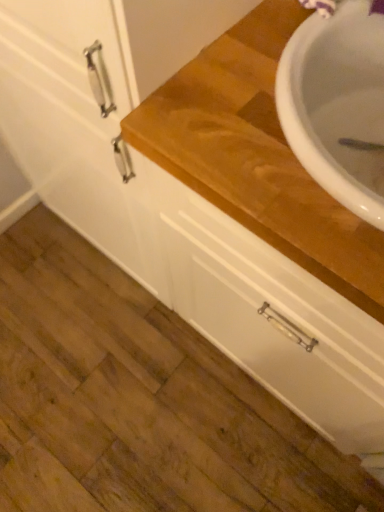
This screenshot has height=512, width=384. Describe the element at coordinates (273, 315) in the screenshot. I see `white matte drawer at center` at that location.

Locate an element on the screen. Image resolution: width=384 pixels, height=512 pixels. white matte drawer at center is located at coordinates (273, 315).

Find the location of a particular element. The height and width of the screenshot is (512, 384). wooden at upper right is located at coordinates (256, 155).

What do you see at coordinates (256, 155) in the screenshot? The image size is (384, 512). I see `wooden at upper right` at bounding box center [256, 155].

What is the approximate height of wooden at upper right?

wooden at upper right is 35.99 inches in height.

I want to click on white matte drawer at center, so point(273,315).

Consider the image. Is white matte drawer at center at the right side of wooden at upper right?

In fact, white matte drawer at center is to the left of wooden at upper right.

Which object is further away from the camera, white matte drawer at center or wooden at upper right?

white matte drawer at center is further away from the camera.

Which is farther, (363, 452) or (188, 132)?

The point (363, 452) is farther.

From the image's perspective, is white matte drawer at center above or below wooden at upper right?

Based on their image positions, white matte drawer at center is located beneath wooden at upper right.

From a real-world perspective, who is located lower, white matte drawer at center or wooden at upper right?

From a 3D spatial view, white matte drawer at center is below.

Can you confirm if white matte drawer at center is thinner than wooden at upper right?

Incorrect, the width of white matte drawer at center is not less than that of wooden at upper right.

Is white matte drawer at center taller than wooden at upper right?

No.

Between white matte drawer at center and wooden at upper right, which one has larger size?

wooden at upper right is bigger.

Is white matte drawer at center inside or outside of wooden at upper right?

white matte drawer at center lies outside wooden at upper right.

From the picture: Are white matte drawer at center and wooden at upper right far apart?

That's not correct — white matte drawer at center is a little close to wooden at upper right.

Is wooden at upper right at the back of white matte drawer at center?

No, white matte drawer at center is not facing away from wooden at upper right.

How different are the orientations of white matte drawer at center and wooden at upper right in degrees?

89.1 degrees separate the facing orientations of white matte drawer at center and wooden at upper right.

Find the location of a particular element. drawer on the left of wooden at upper right is located at coordinates (273, 315).

Is wooden at upper right to the left of white matte drawer at center from the viewer's perspective?

Incorrect, wooden at upper right is not on the left side of white matte drawer at center.

Considering the positions of objects wooden at upper right and white matte drawer at center in the image provided, who is behind, wooden at upper right or white matte drawer at center?

white matte drawer at center is more distant.

Which is behind, point (203, 175) or point (315, 354)?

Positioned behind is point (315, 354).

From the image's perspective, between wooden at upper right and white matte drawer at center, which one is located above?

wooden at upper right, from the image's perspective.

From a real-world perspective, which is physically above, wooden at upper right or white matte drawer at center?

In real-world perspective, wooden at upper right is above.

Between wooden at upper right and white matte drawer at center, which one has smaller width?

With smaller width is wooden at upper right.

Is wooden at upper right shorter than white matte drawer at center?

No.

Who is bigger, wooden at upper right or white matte drawer at center?

wooden at upper right is bigger.

Would you say white matte drawer at center is part of wooden at upper right's contents?

No, white matte drawer at center is not a part of wooden at upper right.

Is wooden at upper right beside white matte drawer at center?

wooden at upper right and white matte drawer at center are clearly separated.

Is wooden at upper right looking in the opposite direction of white matte drawer at center?

wooden at upper right does not have its back to white matte drawer at center.

How distant is wooden at upper right from white matte drawer at center?

They are 11.59 inches apart.

Find the location of a particular element. Image resolution: width=384 pixels, height=512 pixels. drawer below the wooden at upper right (from the image's perspective) is located at coordinates (273, 315).

Locate an element on the screen. This screenshot has width=384, height=512. drawer below the wooden at upper right (from a real-world perspective) is located at coordinates (273, 315).

Image resolution: width=384 pixels, height=512 pixels. I want to click on countertop in front of the white matte drawer at center, so click(x=256, y=155).